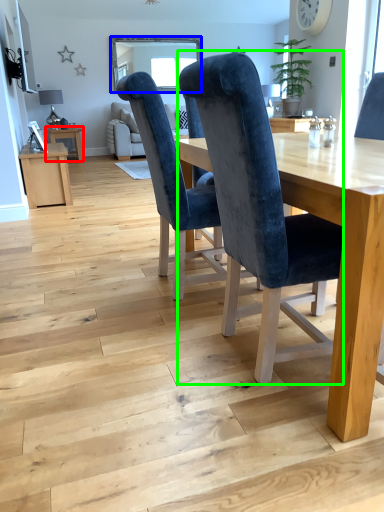
Question: Considering the real-world distances, which object is farthest from table (highlighted by a red box)? window screen (highlighted by a blue box) or chair (highlighted by a green box)?

Choices:
 (A) window screen
 (B) chair

Answer: (B)